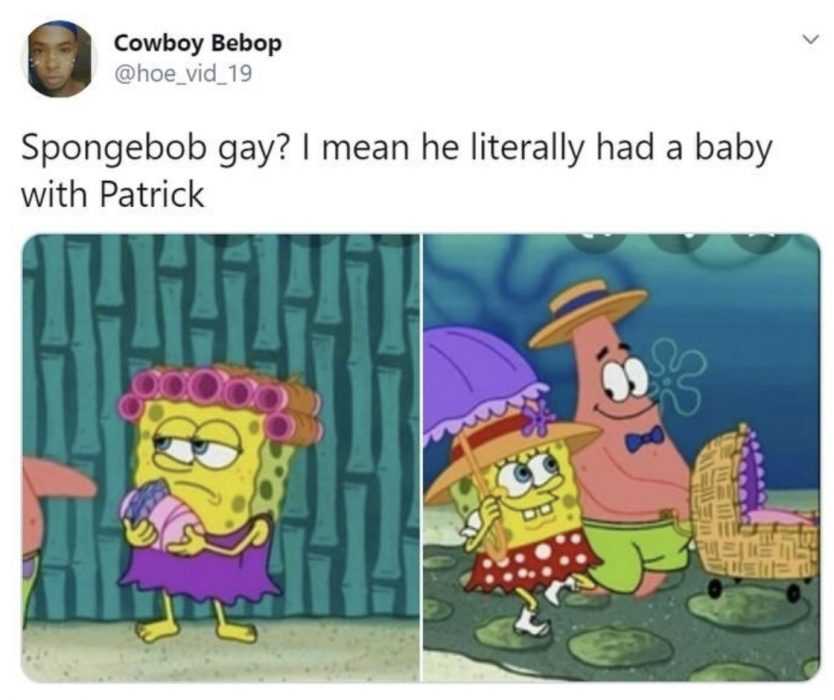
Locate an element on the screen. The image size is (834, 700). green background wall is located at coordinates click(x=327, y=536).